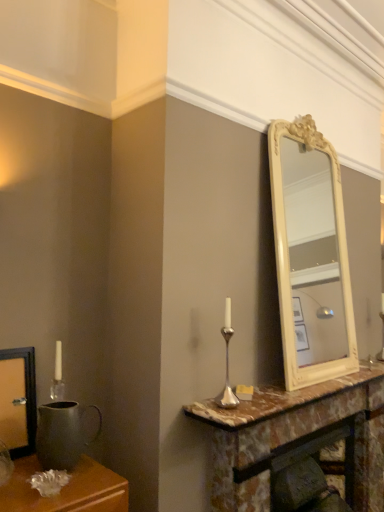
Describe the element at coordinates (285, 400) in the screenshot. I see `marble at center` at that location.

What are the coordinates of `marble fireplace at center` in the screenshot? It's located at (297, 439).

Image resolution: width=384 pixels, height=512 pixels. In order to click on marble at center in this screenshot , I will do `click(285, 400)`.

Looking at this image, are marble fireplace at center and matte metal pitcher at left far apart?

Actually, marble fireplace at center and matte metal pitcher at left are a little close together.

From the picture: Is marble fireplace at center to the left or to the right of matte metal pitcher at left in the image?

Clearly, marble fireplace at center is on the right of matte metal pitcher at left in the image.

The image size is (384, 512). In order to click on gray above the marble fireplace at center (from a real-world perspective) in this screenshot , I will do `click(62, 434)`.

Is marble fireplace at center not inside matte metal pitcher at left?

Indeed, marble fireplace at center is completely outside matte metal pitcher at left.

From a real-world perspective, between silver metallic candle holder at center and matte metal pitcher at left, who is vertically higher?

silver metallic candle holder at center.

Is the surface of silver metallic candle holder at center in direct contact with matte metal pitcher at left?

No, silver metallic candle holder at center is not in contact with matte metal pitcher at left.

Which object is further away from the camera, silver metallic candle holder at center or matte metal pitcher at left?

silver metallic candle holder at center is more distant.

Which object is positioned more to the right, silver metallic candle holder at center or matte metal pitcher at left?

Positioned to the right is silver metallic candle holder at center.

Between point (355, 380) and point (72, 451), which one is positioned behind?

The point (355, 380) is farther.

From the picture: Is marble at center not close to matte metal pitcher at left?

That's not correct — marble at center is a little close to matte metal pitcher at left.

Looking at this image, in terms of size, does marble at center appear bigger or smaller than matte metal pitcher at left?

Considering their sizes, marble at center takes up more space than matte metal pitcher at left.

How far apart are marble at center and matte metal pitcher at left?

marble at center is 25.55 inches away from matte metal pitcher at left.

From the image's perspective, is silver metallic candle holder at center located above marble at center?

Yes, from the image's perspective, silver metallic candle holder at center is on top of marble at center.

Is silver metallic candle holder at center situated inside marble at center or outside?

silver metallic candle holder at center is located beyond the bounds of marble at center.

Does silver metallic candle holder at center turn towards marble at center?

No, silver metallic candle holder at center is not turned towards marble at center.

From their relative heights in the image, would you say silver metallic candle holder at center is taller or shorter than marble at center?

Considering their sizes, silver metallic candle holder at center has more height than marble at center.

Where is `candle holder above the marble fireplace at center (from a real-world perspective)`? This screenshot has width=384, height=512. candle holder above the marble fireplace at center (from a real-world perspective) is located at coordinates (227, 362).

From the image's perspective, is silver metallic candle holder at center on top of marble fireplace at center?

Correct, silver metallic candle holder at center appears higher than marble fireplace at center in the image.

Are silver metallic candle holder at center and marble fireplace at center far apart?

Actually, silver metallic candle holder at center and marble fireplace at center are a little close together.

Can you confirm if silver metallic candle holder at center is wider than marble fireplace at center?

Incorrect, the width of silver metallic candle holder at center does not surpass that of marble fireplace at center.

From a real-world perspective, relative to silver metallic candle holder at center, is matte metal pitcher at left vertically above or below?

In terms of real-world spatial position, matte metal pitcher at left is below silver metallic candle holder at center.

Do you think matte metal pitcher at left is within silver metallic candle holder at center, or outside of it?

matte metal pitcher at left is not inside silver metallic candle holder at center, it's outside.

Measure the distance between matte metal pitcher at left and silver metallic candle holder at center.

They are 23.94 inches apart.

From the image's perspective, is matte metal pitcher at left above silver metallic candle holder at center?

No, from the image's perspective, matte metal pitcher at left is not over silver metallic candle holder at center.

Which object is further away from the camera taking this photo, marble at center or silver metallic candle holder at center?

silver metallic candle holder at center is more distant.

From a real-world perspective, is marble at center located higher than silver metallic candle holder at center?

Incorrect, from a real-world perspective, marble at center is lower than silver metallic candle holder at center.

Where is `candle holder above the marble at center (from the image's perspective)`? The height and width of the screenshot is (512, 384). candle holder above the marble at center (from the image's perspective) is located at coordinates (227, 362).

Consider the image. From the image's perspective, relative to silver metallic candle holder at center, is marble at center above or below?

Clearly, from the image's perspective, marble at center is below silver metallic candle holder at center.

Where is `gray above the marble fireplace at center (from the image's perspective)`? gray above the marble fireplace at center (from the image's perspective) is located at coordinates (62, 434).

The width and height of the screenshot is (384, 512). What are the coordinates of `gray that is on the left side of silver metallic candle holder at center` in the screenshot? It's located at (62, 434).

Looking at this image, which object lies nearer to the anchor point matte metal pitcher at left, silver metallic candle holder at center or marble at center?

Among the two, silver metallic candle holder at center is located nearer to matte metal pitcher at left.

From the image, which object appears to be nearer to silver metallic candle holder at center, matte metal pitcher at left or marble fireplace at center?

Among the two, marble fireplace at center is located nearer to silver metallic candle holder at center.

Which object lies further to the anchor point silver metallic candle holder at center, marble fireplace at center or matte metal pitcher at left?

matte metal pitcher at left is further to silver metallic candle holder at center.

Looking at the image, which one is located closer to silver metallic candle holder at center, marble at center or matte metal pitcher at left?

marble at center lies closer to silver metallic candle holder at center than the other object.

When comparing their distances from matte metal pitcher at left, does silver metallic candle holder at center or marble fireplace at center seem further?

marble fireplace at center.

Looking at this image, considering their positions, is matte metal pitcher at left positioned further to marble at center than silver metallic candle holder at center?

matte metal pitcher at left is positioned further to the anchor marble at center.

Estimate the real-world distances between objects in this image. Which object is further from marble at center, silver metallic candle holder at center or matte metal pitcher at left?

matte metal pitcher at left lies further to marble at center than the other object.

Consider the image. When comparing their distances from marble fireplace at center, does matte metal pitcher at left or silver metallic candle holder at center seem further?

The object further to marble fireplace at center is matte metal pitcher at left.

Locate an element on the screen. table between matte metal pitcher at left and marble at center is located at coordinates click(297, 439).

The height and width of the screenshot is (512, 384). Find the location of `candle holder between matte metal pitcher at left and marble at center in the horizontal direction`. candle holder between matte metal pitcher at left and marble at center in the horizontal direction is located at coordinates (227, 362).

Locate an element on the screen. The height and width of the screenshot is (512, 384). counter top between silver metallic candle holder at center and marble fireplace at center from top to bottom is located at coordinates tap(285, 400).

Where is `candle holder between matte metal pitcher at left and marble fireplace at center from left to right`? The image size is (384, 512). candle holder between matte metal pitcher at left and marble fireplace at center from left to right is located at coordinates (227, 362).